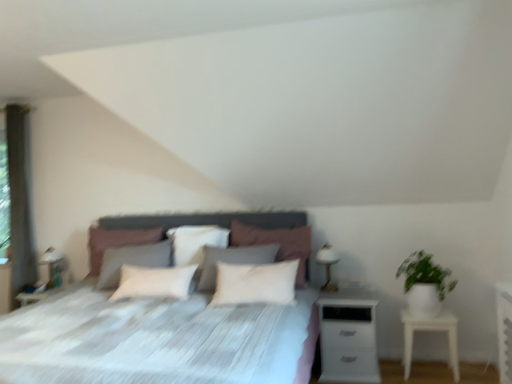
Question: Is the depth of white soft pillow at center, acting as the 3th pillow starting from the right, greater than that of white matte nightstand at right, acting as the 1th nightstand starting from the left?

Choices:
 (A) no
 (B) yes

Answer: (B)

Question: Is white soft pillow at center, the first pillow in the left-to-right sequence, not near white matte nightstand at right, acting as the 1th nightstand starting from the left?

Choices:
 (A) no
 (B) yes

Answer: (B)

Question: From a real-world perspective, is white soft pillow at center, acting as the 3th pillow starting from the right, over white matte nightstand at right, acting as the 1th nightstand starting from the left?

Choices:
 (A) no
 (B) yes

Answer: (B)

Question: Does white soft pillow at center, acting as the 3th pillow starting from the right, have a smaller size compared to white matte nightstand at right, marked as the second nightstand in a right-to-left arrangement?

Choices:
 (A) no
 (B) yes

Answer: (B)

Question: Is white soft pillow at center, the first pillow in the left-to-right sequence, in contact with white matte nightstand at right, acting as the 1th nightstand starting from the left?

Choices:
 (A) no
 (B) yes

Answer: (A)

Question: Could you tell me if white soft pillow at center, the first pillow in the left-to-right sequence, is turned towards white matte nightstand at right, marked as the second nightstand in a right-to-left arrangement?

Choices:
 (A) no
 (B) yes

Answer: (A)

Question: Is white matte nightstand at right, acting as the 1th nightstand starting from the left, wider than green matte plant at right?

Choices:
 (A) yes
 (B) no

Answer: (A)

Question: Can you confirm if white matte nightstand at right, marked as the second nightstand in a right-to-left arrangement, is taller than green matte plant at right?

Choices:
 (A) no
 (B) yes

Answer: (B)

Question: Is the surface of white matte nightstand at right, marked as the second nightstand in a right-to-left arrangement, in direct contact with green matte plant at right?

Choices:
 (A) yes
 (B) no

Answer: (B)

Question: Does white matte nightstand at right, marked as the second nightstand in a right-to-left arrangement, come behind green matte plant at right?

Choices:
 (A) yes
 (B) no

Answer: (A)

Question: Are white matte nightstand at right, acting as the 1th nightstand starting from the left, and green matte plant at right far apart?

Choices:
 (A) no
 (B) yes

Answer: (A)

Question: Could green matte plant at right be considered to be inside white matte nightstand at right, marked as the second nightstand in a right-to-left arrangement?

Choices:
 (A) no
 (B) yes

Answer: (A)

Question: Can you confirm if white soft pillow at center, which ranks as the third pillow in left-to-right order, is smaller than white fabric bed at center?

Choices:
 (A) yes
 (B) no

Answer: (A)